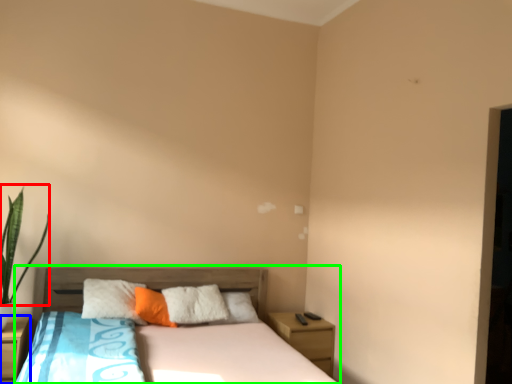
Question: Which object is positioned farthest from plant (highlighted by a red box)? Select from nightstand (highlighted by a blue box) and bed (highlighted by a green box).

Choices:
 (A) nightstand
 (B) bed

Answer: (B)